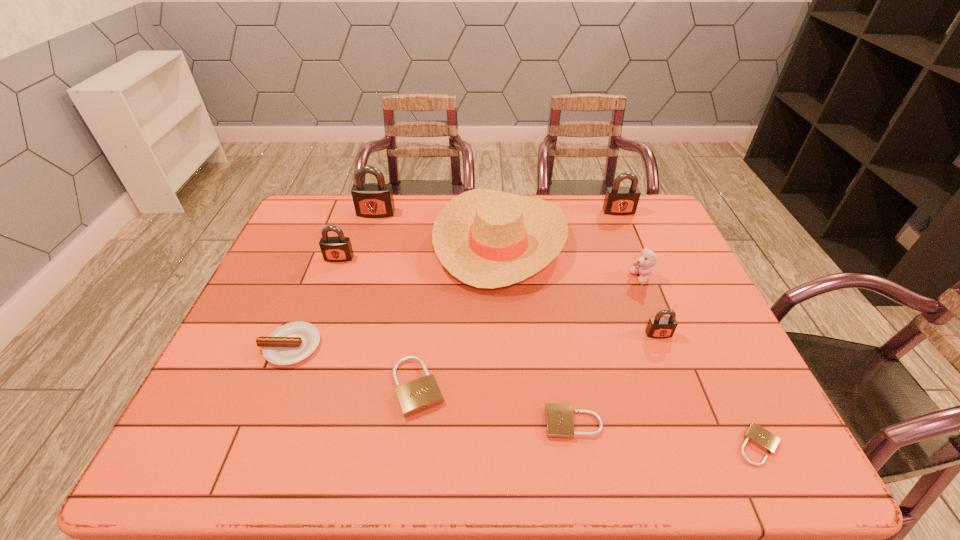
Find the location of `free space that is in between the pink teddy bear and the ninth shortest object`. free space that is in between the pink teddy bear and the ninth shortest object is located at coordinates (630, 245).

Image resolution: width=960 pixels, height=540 pixels. I want to click on unoccupied position between the tallest padlock and the fifth shortest padlock, so click(357, 235).

Identify the location of free space between the sunhat and the fifth nearest padlock. (420, 249).

Locate an element on the screen. free spot between the sausage and the smallest gray padlock is located at coordinates (474, 340).

Where is `free area in between the second tallest padlock and the seventh tallest object`? This screenshot has width=960, height=540. free area in between the second tallest padlock and the seventh tallest object is located at coordinates (455, 279).

This screenshot has width=960, height=540. I want to click on vacant space that is in between the second biggest gray padlock and the ninth tallest object, so click(596, 317).

Locate which object is the ninth closest to the second biggest gray padlock. Please provide its 2D coordinates. Your answer should be formatted as a tuple, i.e. [(x, y)], where the tuple contains the x and y coordinates of a point satisfying the conditions above.

[(293, 342)]

At what (x,y) coordinates should I click in order to perform the action: click on object that is the fourth closest one to the second shortest padlock. Please return your answer as a coordinate pair (x, y). Looking at the image, I should click on (486, 238).

Identify which padlock is located as the third nearest to the sunhat. Please provide its 2D coordinates. Your answer should be formatted as a tuple, i.e. [(x, y)], where the tuple contains the x and y coordinates of a point satisfying the conditions above.

[(660, 327)]

Locate an element on the screen. The image size is (960, 540). padlock that stands as the third closest to the tallest padlock is located at coordinates (620, 201).